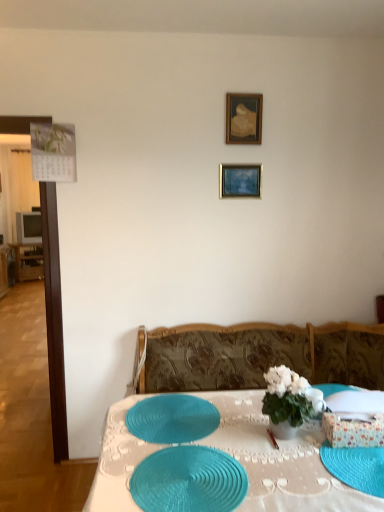
Find the location of a particular element. This screenshot has width=384, height=512. free space in front of white glossy vase at center is located at coordinates (303, 459).